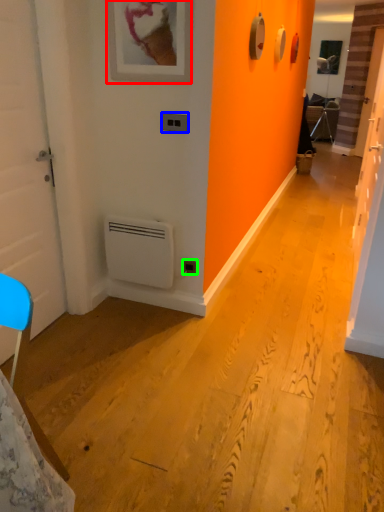
Question: Which object is positioned farthest from picture frame (highlighted by a red box)? Select from light switch (highlighted by a blue box) and electric outlet (highlighted by a green box).

Choices:
 (A) light switch
 (B) electric outlet

Answer: (B)